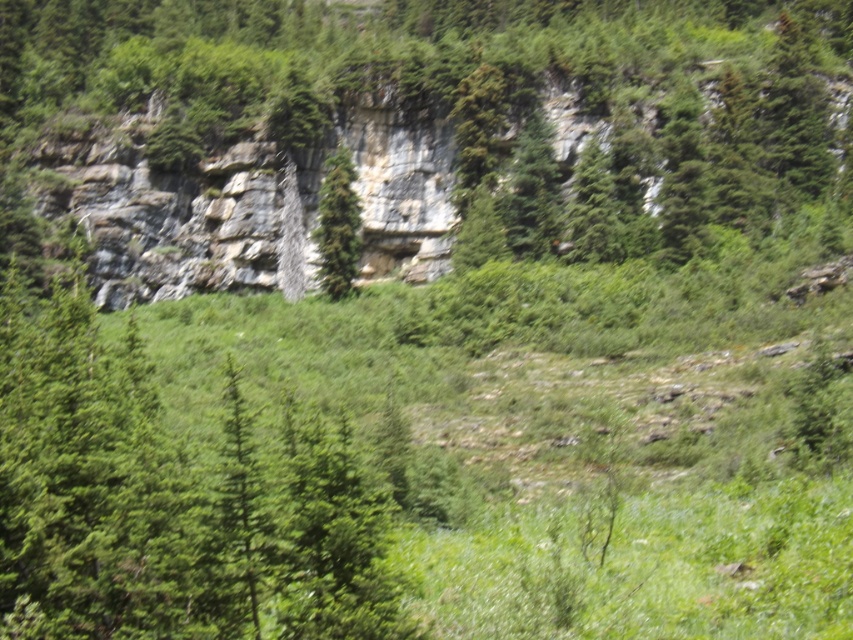
Between point (231, 470) and point (456, 246), which one is positioned behind?

The point (456, 246) is more distant.

In the scene shown: Who is positioned more to the left, green matte tree at center or green leafy tree at center?

green matte tree at center

Between point (259, 582) and point (491, 259), which one is positioned behind?

Point (491, 259)

Where is `green matte tree at center`? Image resolution: width=853 pixels, height=640 pixels. green matte tree at center is located at coordinates (238, 520).

Which is above, green textured tree at center or green leafy tree at center?

green textured tree at center is above.

This screenshot has width=853, height=640. Find the location of `green textured tree at center`. green textured tree at center is located at coordinates (337, 225).

Is green leafy tree at upper center positioned in front of green textured tree at center?

Yes, it is.

Which is more to the left, green leafy tree at upper center or green textured tree at center?

green leafy tree at upper center

This screenshot has height=640, width=853. I want to click on green leafy tree at upper center, so click(x=171, y=500).